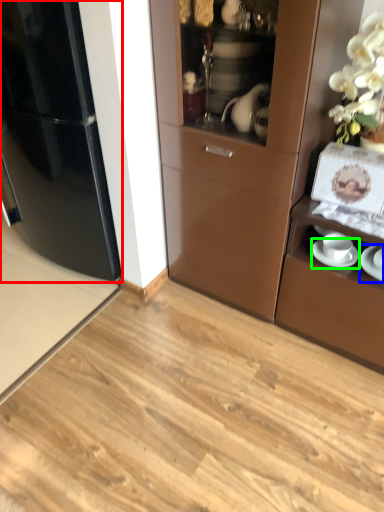
Question: Estimate the real-world distances between objects in this image. Which object is farther from refrigerator (highlighted by a red box), saucer (highlighted by a blue box) or saucer (highlighted by a green box)?

Choices:
 (A) saucer
 (B) saucer

Answer: (A)